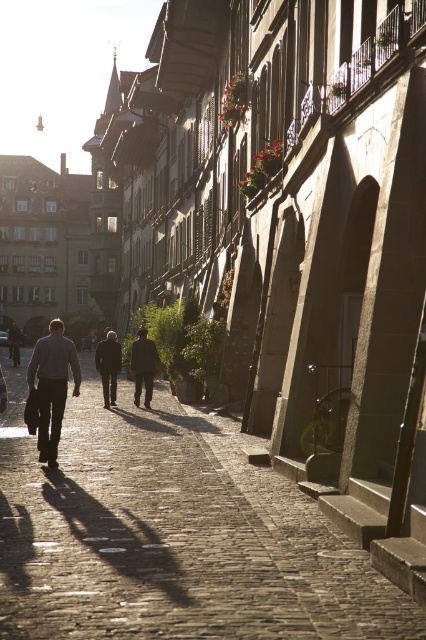
You are a delivery person with a 1.5 meter wide cart. You need to navigate through the cobblestone pavement at center and the dark brown suit at center. Which path should you choose to ensure your cart can pass through without getting stuck?

The cobblestone pavement at center is larger in size than the dark brown suit at center, so you should choose the cobblestone pavement at center path to ensure your cart can pass through without getting stuck.

You are a photographer standing on the cobblestone street in the scene. You want to take a photo that includes both the gray woolen sweater at center and the dark brown suit at center. What is the minimum distance you need to move backward to ensure both are fully visible in your camera frame?

The gray woolen sweater at center and dark brown suit at center are 11.25 meters apart from each other. To capture both in the frame, you need to move back at least 11.25 meters so that the distance between them fits within your camera view.

You are a fashion designer observing a crowd in the historic district. You notice a person wearing a gray woolen sweater at center and a dark brown leather jacket at center. Which clothing item is positioned higher on the person?

The gray woolen sweater at center is located above the dark brown leather jacket at center, so the gray woolen sweater at center is positioned higher on the person.